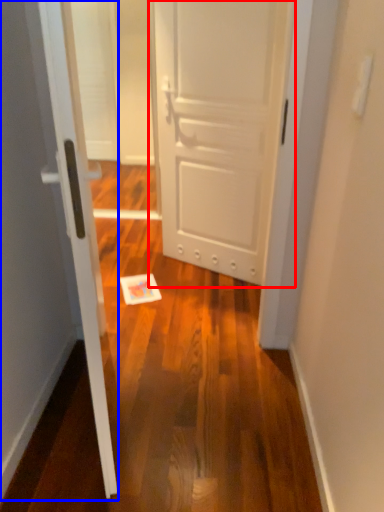
Question: Which object is closer to the camera taking this photo, door (highlighted by a red box) or door (highlighted by a blue box)?

Choices:
 (A) door
 (B) door

Answer: (B)